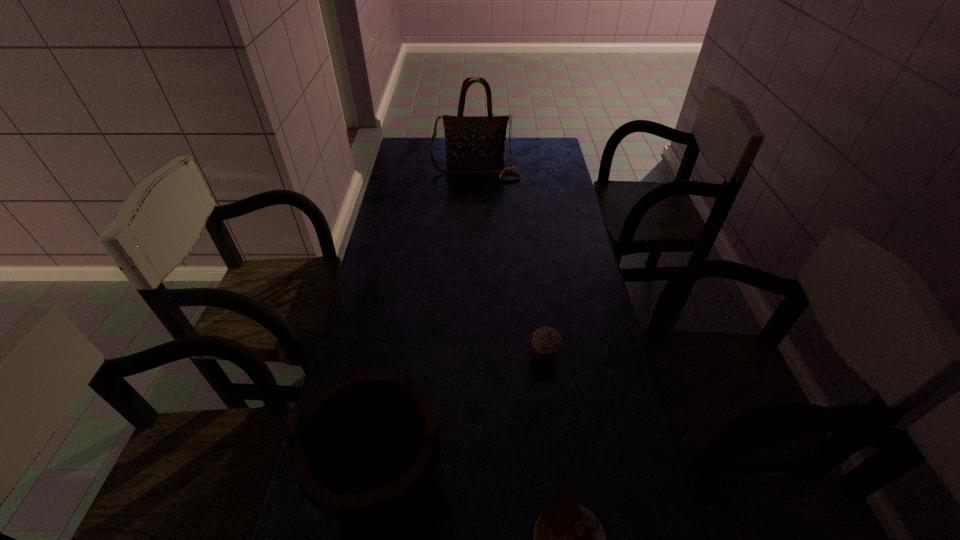
I want to click on free point that satisfies the following two spatial constraints: 1. on the front-facing side of the muffin; 2. on the right side of the handbag, so click(x=472, y=356).